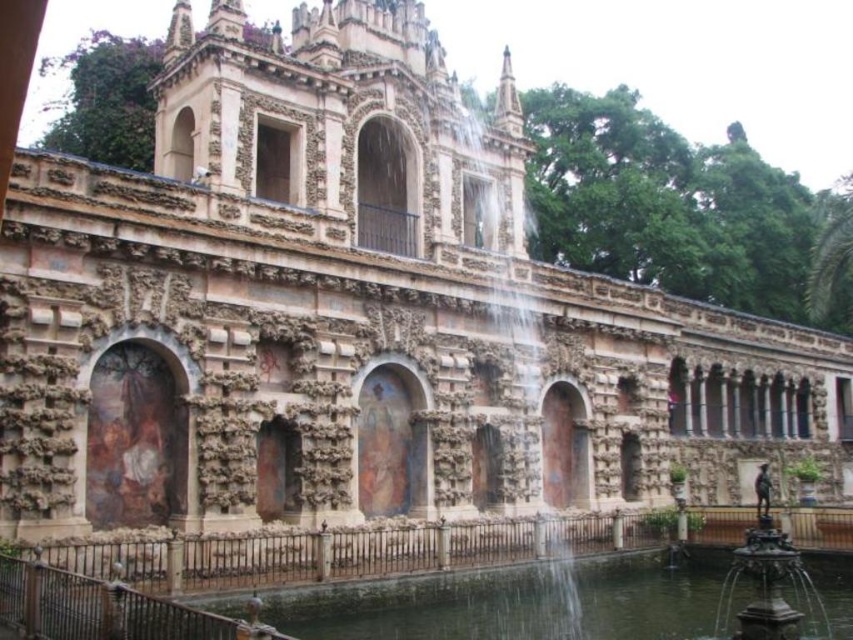
Between clear water at fountain center and bronze/ornate fountain at lower right, which one is positioned higher?

Positioned higher is bronze/ornate fountain at lower right.

Can you confirm if clear water at fountain center is positioned above bronze/ornate fountain at lower right?

No, clear water at fountain center is not above bronze/ornate fountain at lower right.

You are a GUI agent. You are given a task and a screenshot of the screen. Output one action in this format:
    pyautogui.click(x=<x>, y=<y>)
    Task: Click on the clear water at fountain center
    The height and width of the screenshot is (640, 853).
    Given the screenshot: What is the action you would take?
    click(515, 602)